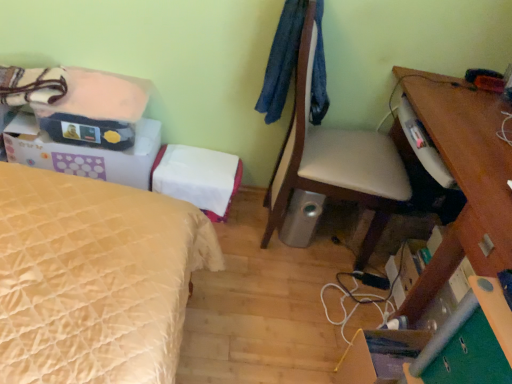
The height and width of the screenshot is (384, 512). In order to click on free space in front of white leather chair at center in this screenshot , I will do `click(271, 308)`.